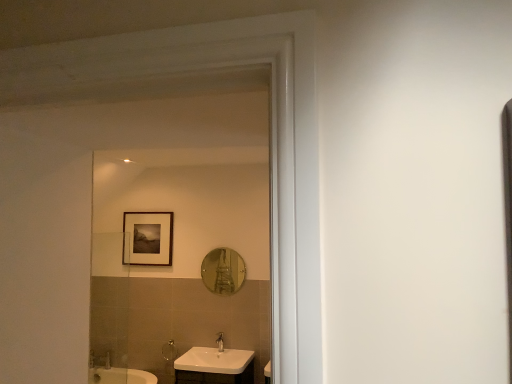
Question: Can you confirm if white glossy sink at lower center is bigger than silver metallic faucet at lower center?

Choices:
 (A) yes
 (B) no

Answer: (A)

Question: Does white glossy sink at lower center appear on the left side of silver metallic faucet at lower center?

Choices:
 (A) yes
 (B) no

Answer: (A)

Question: Does white glossy sink at lower center have a greater width compared to silver metallic faucet at lower center?

Choices:
 (A) no
 (B) yes

Answer: (B)

Question: Is the surface of white glossy sink at lower center in direct contact with silver metallic faucet at lower center?

Choices:
 (A) yes
 (B) no

Answer: (B)

Question: Can you confirm if white glossy sink at lower center is shorter than silver metallic faucet at lower center?

Choices:
 (A) no
 (B) yes

Answer: (B)

Question: In the image, is matte black picture frame at upper center positioned in front of or behind shiny silver mirror at center?

Choices:
 (A) behind
 (B) front

Answer: (A)

Question: From a real-world perspective, is matte black picture frame at upper center positioned above or below shiny silver mirror at center?

Choices:
 (A) above
 (B) below

Answer: (A)

Question: From the image's perspective, is matte black picture frame at upper center above or below shiny silver mirror at center?

Choices:
 (A) above
 (B) below

Answer: (A)

Question: Is matte black picture frame at upper center wider or thinner than shiny silver mirror at center?

Choices:
 (A) thin
 (B) wide

Answer: (B)

Question: Looking at the image, does silver metallic faucet at lower center seem bigger or smaller compared to shiny silver mirror at center?

Choices:
 (A) small
 (B) big

Answer: (A)

Question: From the image's perspective, is silver metallic faucet at lower center located above or below shiny silver mirror at center?

Choices:
 (A) below
 (B) above

Answer: (A)

Question: Considering the positions of silver metallic faucet at lower center and shiny silver mirror at center in the image, is silver metallic faucet at lower center taller or shorter than shiny silver mirror at center?

Choices:
 (A) short
 (B) tall

Answer: (A)

Question: Looking at their shapes, would you say silver metallic faucet at lower center is wider or thinner than shiny silver mirror at center?

Choices:
 (A) thin
 (B) wide

Answer: (B)

Question: From a real-world perspective, is matte white shower at lower left above or below white glossy sink at lower center?

Choices:
 (A) below
 (B) above

Answer: (B)

Question: Is matte white shower at lower left in front of or behind white glossy sink at lower center in the image?

Choices:
 (A) behind
 (B) front

Answer: (A)